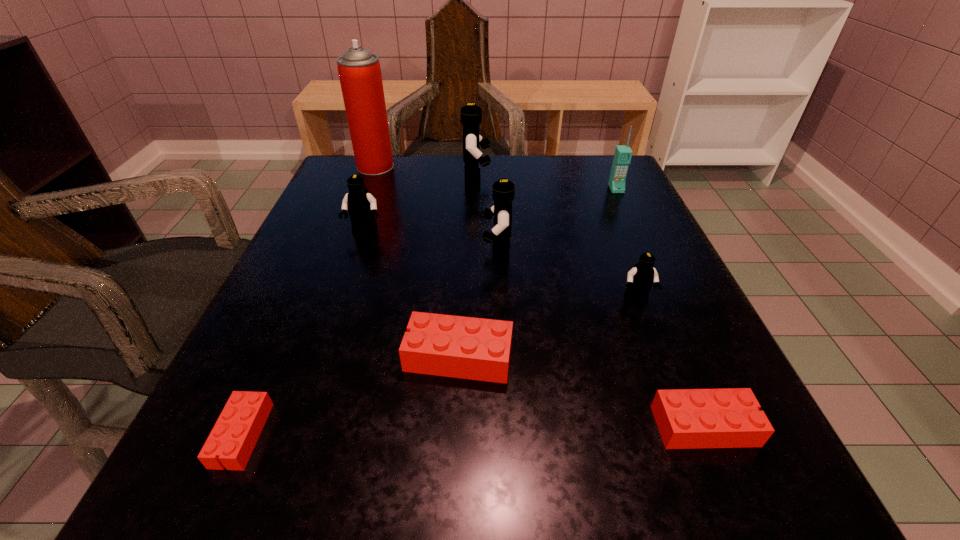
The image size is (960, 540). Find the location of `free space that satisfies the following two spatial constraints: 1. on the front-facing side of the farthest Lego; 2. on the front-facing side of the third biggest black Lego`. free space that satisfies the following two spatial constraints: 1. on the front-facing side of the farthest Lego; 2. on the front-facing side of the third biggest black Lego is located at coordinates (475, 232).